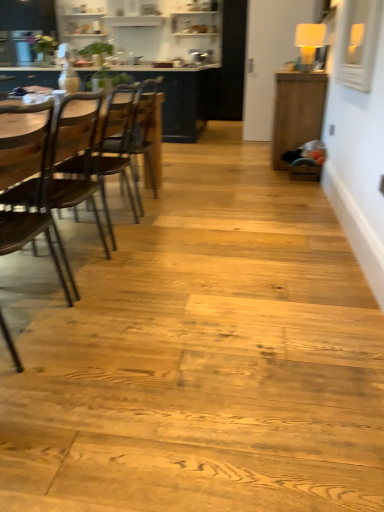
Question: Considering their positions, is wooden cabinet at right, acting as the second table starting from the left, located in front of or behind wooden chair at left, which appears as the 1th chair when viewed from the front?

Choices:
 (A) front
 (B) behind

Answer: (B)

Question: Is wooden cabinet at right, the 1th table in the front-to-back sequence, taller or shorter than wooden chair at left, arranged as the 2th chair when viewed from the back?

Choices:
 (A) short
 (B) tall

Answer: (A)

Question: Estimate the real-world distances between objects in this image. Which object is farther from the wooden chair at left, which appears as the 1th chair when viewed from the front?

Choices:
 (A) wooden chair at left, the 2th chair when ordered from front to back
 (B) wooden chair at left
 (C) wooden table at left, which is the 2th table from right to left
 (D) wooden cabinet at right, which is counted as the first table, starting from the right

Answer: (C)

Question: Which object is positioned farthest from the wooden table at left, which is the 2th table from right to left?

Choices:
 (A) wooden chair at left
 (B) wooden chair at left, which appears as the 1th chair when viewed from the front
 (C) wooden cabinet at right, the 1th table in the front-to-back sequence
 (D) wooden chair at left, which ranks as the 1th chair in back-to-front order

Answer: (A)